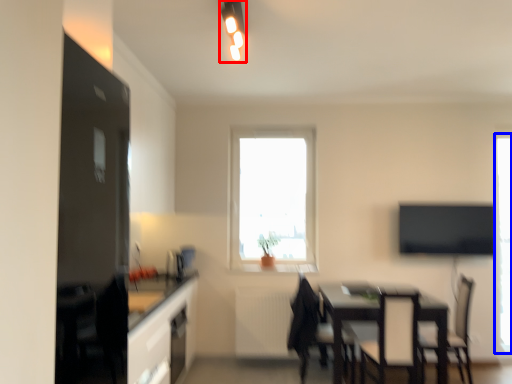
Question: Which of the following is the closest to the observer, light fixture (highlighted by a red box) or window (highlighted by a blue box)?

Choices:
 (A) light fixture
 (B) window

Answer: (A)